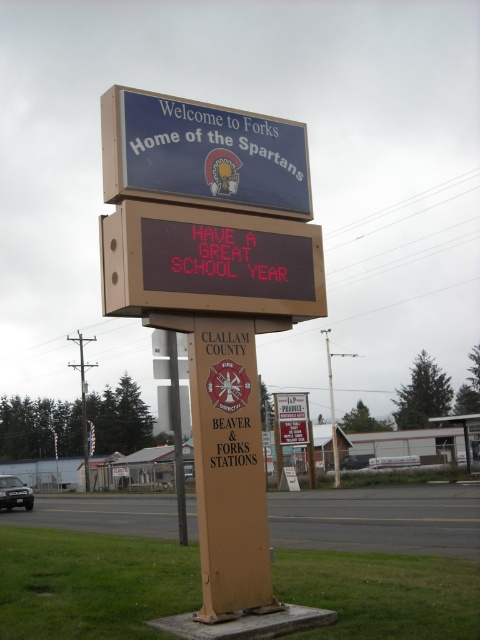
You are a visitor driving towards Forks, Washington, and you see the blue matte signboard at upper center and the metallic pole at center. Which object appears taller from your perspective?

The metallic pole at center is taller than the blue matte signboard at upper center, so the metallic pole at center appears taller from your perspective.

You are a driver approaching the signboard and want to read both the red led display at center and the blue matte signboard at upper center. Which one should you look at first to see the main welcome message?

The blue matte signboard at upper center should be looked at first as it contains the main welcome message, while the red led display at center is located below it.